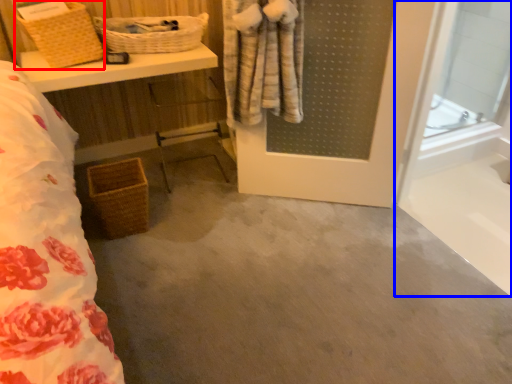
Question: Among these objects, which one is farthest to the camera, basket (highlighted by a red box) or glass door (highlighted by a blue box)?

Choices:
 (A) basket
 (B) glass door

Answer: (A)